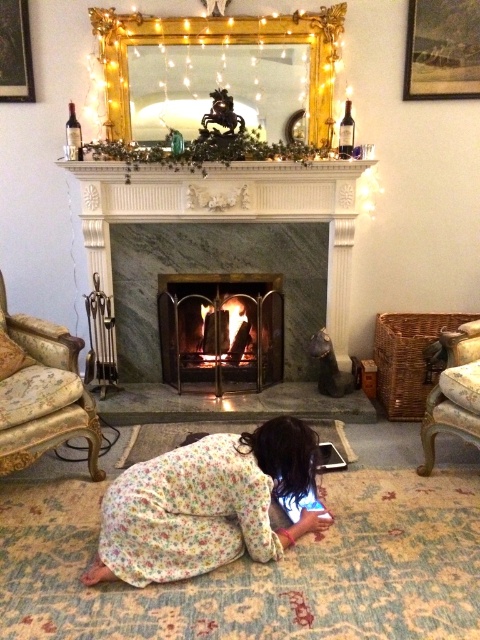
Is marble fireplace at center below wooden armchair at lower right?

No, marble fireplace at center is not below wooden armchair at lower right.

This screenshot has height=640, width=480. What do you see at coordinates (228, 211) in the screenshot?
I see `marble fireplace at center` at bounding box center [228, 211].

Locate an element on the screen. The height and width of the screenshot is (640, 480). marble fireplace at center is located at coordinates (228, 211).

Between gold-patterned armchair at left and wooden armchair at lower right, which one has more height?

gold-patterned armchair at left

Locate an element on the screen. The height and width of the screenshot is (640, 480). gold-patterned armchair at left is located at coordinates (40, 392).

Does point (205, 356) come farther from viewer compared to point (432, 433)?

That is True.

Is gold metal fireplace at center to the right of wooden armchair at lower right from the viewer's perspective?

In fact, gold metal fireplace at center is to the left of wooden armchair at lower right.

Is point (239, 333) more distant than point (436, 403)?

Yes, it is behind point (436, 403).

Find the location of a particular element. gold metal fireplace at center is located at coordinates (220, 330).